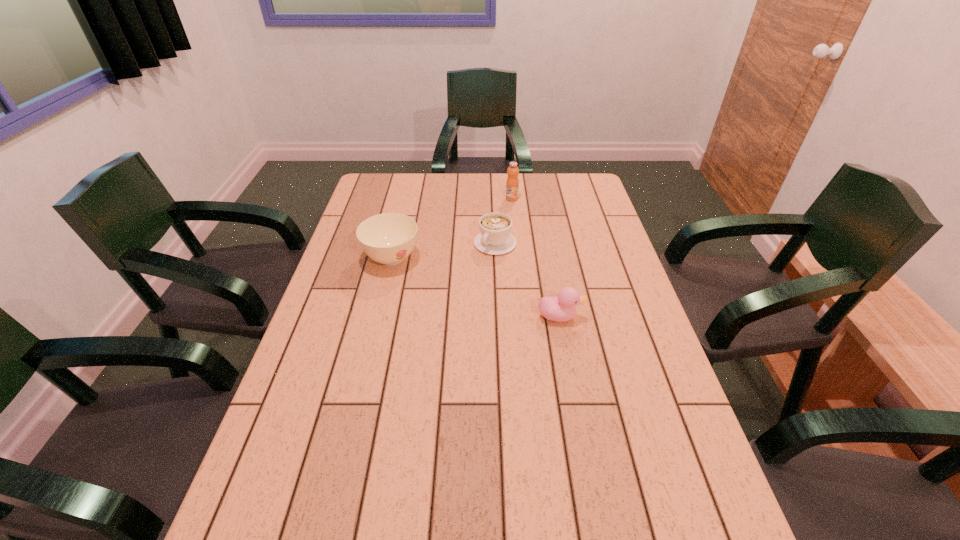
The image size is (960, 540). What are the coordinates of `sugar bowl` in the screenshot? It's located at (388, 238).

In order to click on duckling in this screenshot , I will do `click(562, 308)`.

Find the location of `the nearest object`. the nearest object is located at coordinates (562, 308).

Locate an element on the screen. cappuccino is located at coordinates (495, 238).

I want to click on the farthest object, so click(512, 184).

Find the location of a particular element. The height and width of the screenshot is (540, 960). the tallest object is located at coordinates (512, 184).

This screenshot has width=960, height=540. I want to click on vacant space positioned on the front of the leftmost object, so click(x=366, y=367).

Where is `vacant space positioned on the front-facing side of the rightmost object`? This screenshot has height=540, width=960. vacant space positioned on the front-facing side of the rightmost object is located at coordinates (644, 316).

This screenshot has width=960, height=540. Identify the location of vacant space located to the right of the shortest object's handle. (473, 269).

At what (x,y) coordinates should I click in order to perform the action: click on vacant space positioned to the right of the shortest object's handle. Please return your answer as a coordinate pair (x, y). Looking at the image, I should click on 466,279.